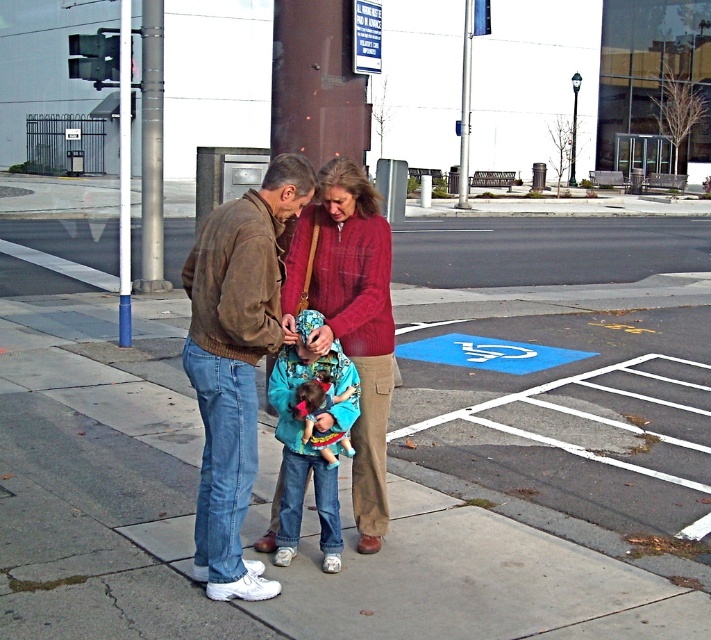
Between point (274, 394) and point (119, 128), which one is positioned behind?

Point (119, 128)

Who is positioned more to the right, denim jacket at center or blue painted metal pole at left?

denim jacket at center is more to the right.

Image resolution: width=711 pixels, height=640 pixels. I want to click on denim jacket at center, so 311,445.

Between blue painted metal pole at left and blue plastic sign at upper center, which one has less height?

With less height is blue plastic sign at upper center.

Can you confirm if blue painted metal pole at left is bigger than blue plastic sign at upper center?

Correct, blue painted metal pole at left is larger in size than blue plastic sign at upper center.

Who is more forward, [124,28] or [356,65]?

Positioned in front is point [356,65].

The width and height of the screenshot is (711, 640). What are the coordinates of `blue painted metal pole at left` in the screenshot? It's located at (124, 173).

Can you confirm if silver metallic pole at upper left is wider than blue plastic sign at upper center?

Yes.

Can you confirm if silver metallic pole at upper left is shorter than blue plastic sign at upper center?

Correct, silver metallic pole at upper left is not as tall as blue plastic sign at upper center.

Where is `silver metallic pole at upper left`? The height and width of the screenshot is (640, 711). silver metallic pole at upper left is located at coordinates (151, 150).

Identify the location of silver metallic pole at upper left. (151, 150).